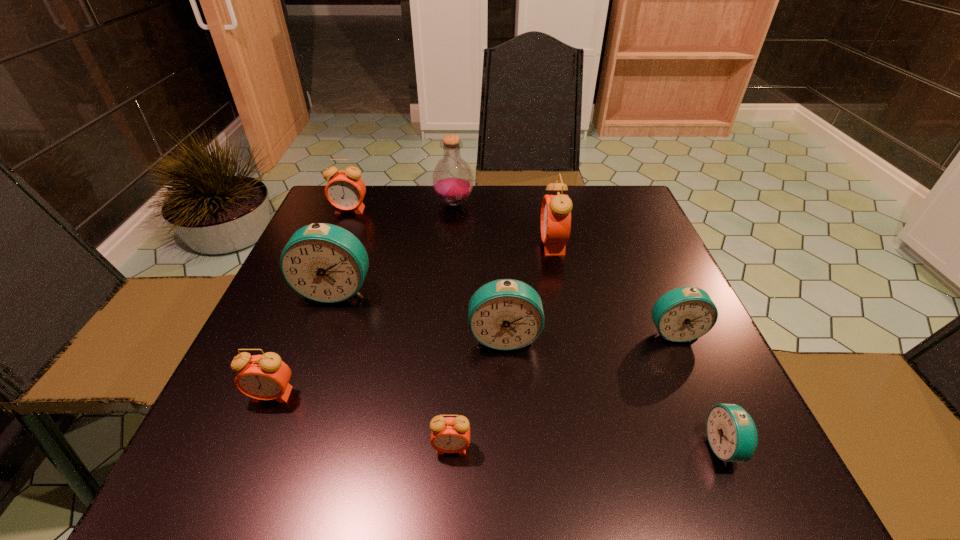
Locate an element on the screen. This screenshot has height=540, width=960. the second smallest blue alarm clock is located at coordinates (683, 314).

Find the location of a particular element. This screenshot has height=540, width=960. the nearest blue alarm clock is located at coordinates (731, 432).

Identify the location of the second pink alarm clock from right to left. pos(448,435).

Where is `the smallest pink alarm clock`? the smallest pink alarm clock is located at coordinates (448, 435).

Identify the location of free region located 0.190m on the right of the bottle. This screenshot has height=540, width=960. (541, 203).

Find the location of a particular element. This screenshot has width=960, height=540. free space located on the face of the biggest pink alarm clock is located at coordinates (448, 244).

The height and width of the screenshot is (540, 960). I want to click on free space located on the face of the biggest pink alarm clock, so click(x=448, y=244).

The height and width of the screenshot is (540, 960). What are the coordinates of `vacant space located 0.080m on the face of the biggest pink alarm clock` in the screenshot? It's located at click(x=509, y=244).

Identify the location of free point located 0.140m on the front-facing side of the sixth nearest object. (311, 360).

Where is `vacant space located on the face of the third smallest pink alarm clock`? This screenshot has width=960, height=540. vacant space located on the face of the third smallest pink alarm clock is located at coordinates (338, 239).